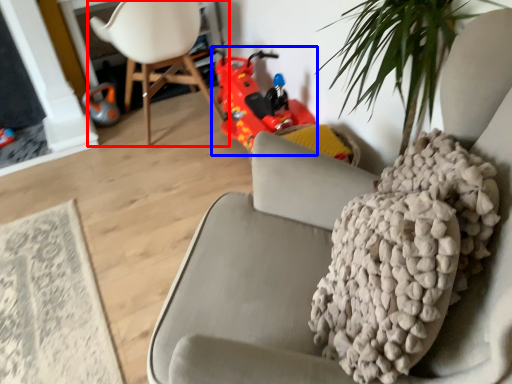
Question: Which object is further to the camera taking this photo, chair (highlighted by a red box) or toy car (highlighted by a blue box)?

Choices:
 (A) chair
 (B) toy car

Answer: (B)